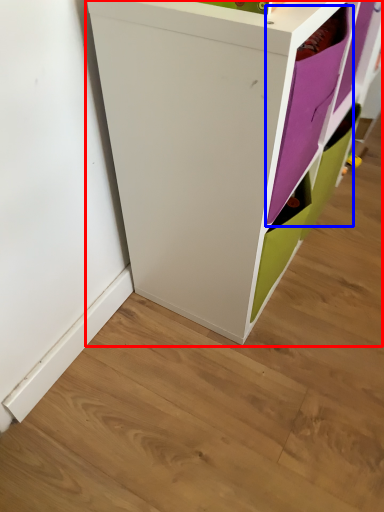
Question: Which of the following is the closest to the observer, cupboard (highlighted by a red box) or shelf (highlighted by a blue box)?

Choices:
 (A) cupboard
 (B) shelf

Answer: (A)